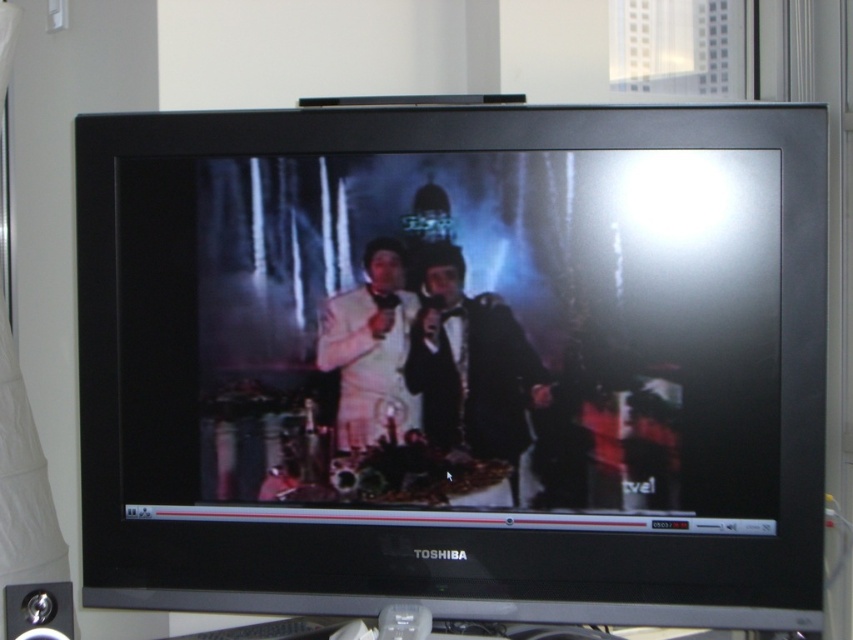
You are a stagehand setting up for a performance. You see the black glossy monitor at center and the black satin tuxedo at center. Which object is placed higher up?

The black glossy monitor at center is positioned over the black satin tuxedo at center, so it is placed higher up.

You are a photographer who needs to capture a closeup of the white satin suit at center without the black glossy monitor at center appearing in the shot. Is this possible given their sizes?

The black glossy monitor at center is larger in size than the white satin suit at center. Therefore, it would be challenging to capture a closeup of the white satin suit at center without the black glossy monitor at center appearing in the shot, as the monitor is bigger and likely occupies more of the frame.

You are standing in front of the Toshiba television and want to locate the black satin tuxedo at center. Where exactly is it positioned on the TV screen?

The black satin tuxedo at center is positioned at the 2D coordinates of point (471, 364) on the TV screen.